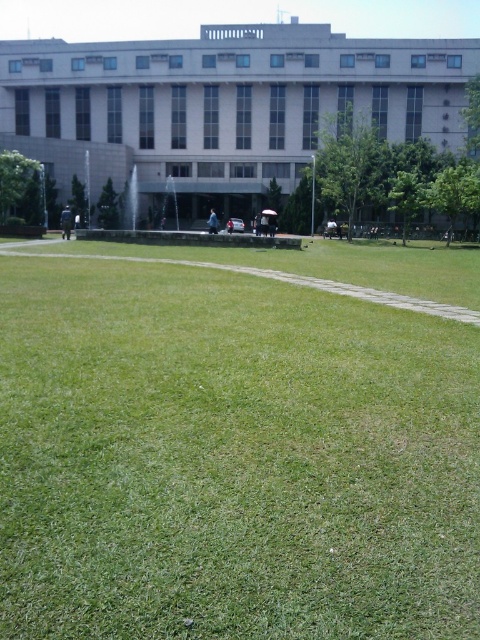
Based on the photo, is green grassy field at center to the right of white concrete building at upper center from the viewer's perspective?

Yes, green grassy field at center is to the right of white concrete building at upper center.

Is point (468, 600) behind point (60, 61)?

That is False.

The height and width of the screenshot is (640, 480). What are the coordinates of `green grassy field at center` in the screenshot? It's located at (230, 460).